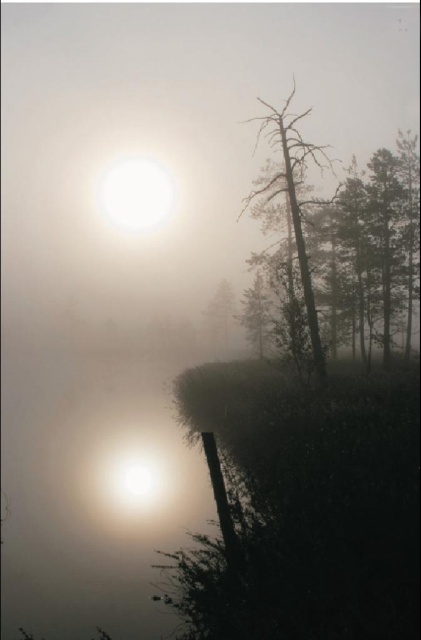
You are planning to plant a new tree between the brown textured tree at right and the smooth green tree at center in the misty landscape. The new tree requires at least 200 meters of space between it and any existing trees. Based on the distance between the two existing trees, is there enough space to plant the new tree between them?

The brown textured tree at right and smooth green tree at center are 231.67 meters apart from each other. Since the new tree requires at least 200 meters of space between it and any existing trees, planting it between them would require dividing the distance so that each side is at least 200 meters. However, 231.67 meters divided by two is approximately 115.83 meters, which is less than 200 meters. Therefore, there is not enough space to plant the new tree between them while maintaining the required 200m.

You are standing at the shoreline in the image and want to walk towards the point labeled point (277, 144). Will you first pass through point (226, 326) before reaching your destination?

Yes, because point (277, 144) is closer to the camera than point (226, 326), so you would pass through point (226, 326) first on your way to point (277, 144).

Looking at this image, you are an environmental scientist analyzing tree growth patterns in misty landscapes. You observe the brown textured tree at right and the smooth green tree at center in the scene. Based on their widths, which tree might have a more extensive root system, and why?

The brown textured tree at right has a larger width than the smooth green tree at center, which suggests it might have a more extensive root system to support its larger size.